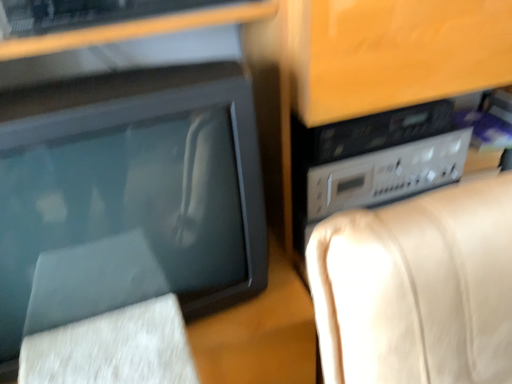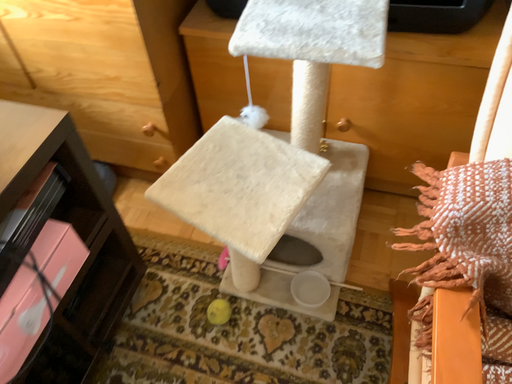
Question: Which way did the camera rotate in the video?

Choices:
 (A) rotated upward
 (B) rotated downward

Answer: (B)